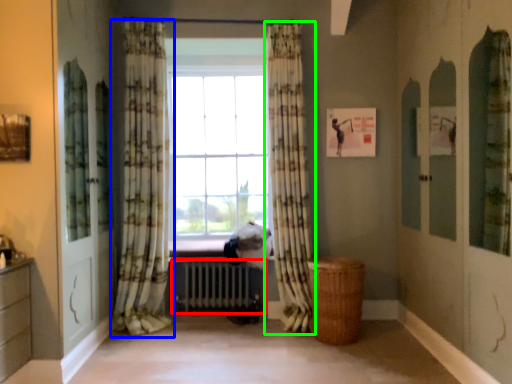
Question: Estimate the real-world distances between objects in this image. Which object is farther from radiator (highlighted by a red box), curtain (highlighted by a blue box) or curtain (highlighted by a green box)?

Choices:
 (A) curtain
 (B) curtain

Answer: (B)